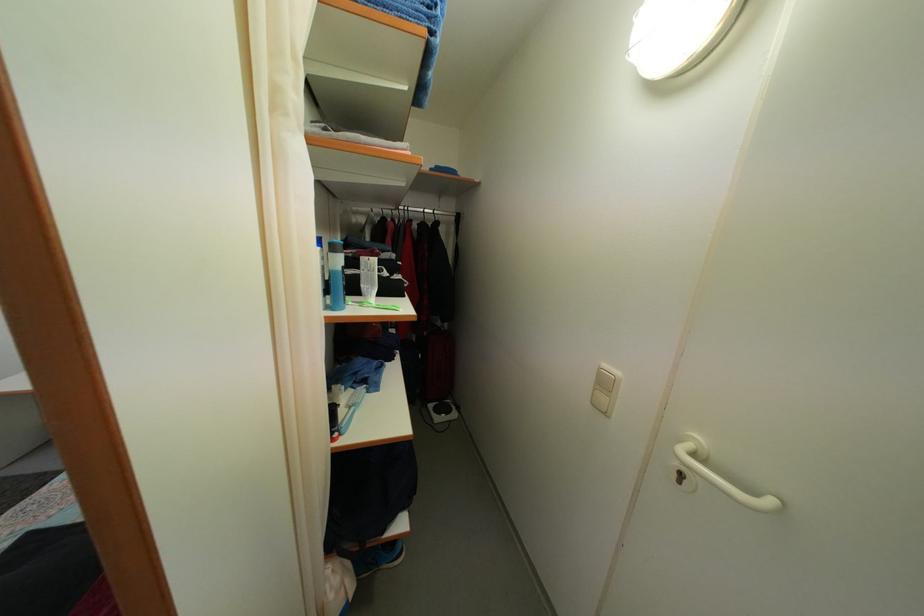
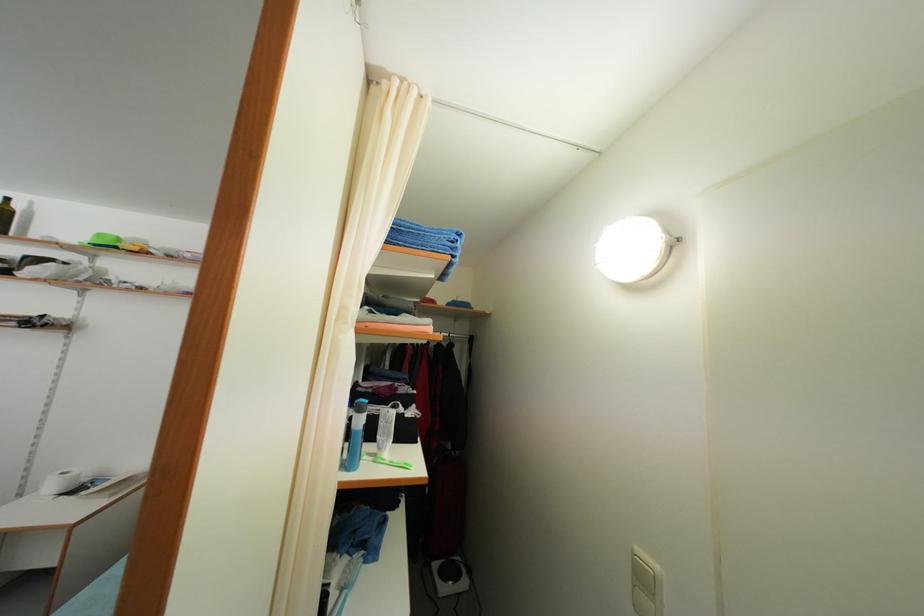
The point at (x=610, y=391) is marked in the first image. Where is the corresponding point in the second image?

(649, 586)